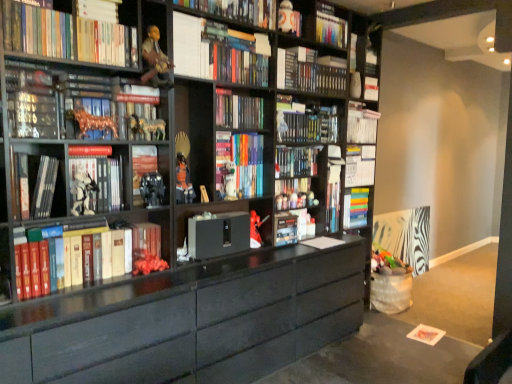
The height and width of the screenshot is (384, 512). In order to click on free point above multicolored hardcover books at center, acting as the 6th book starting from the top (from a real-world perspective) in this screenshot , I will do `click(241, 94)`.